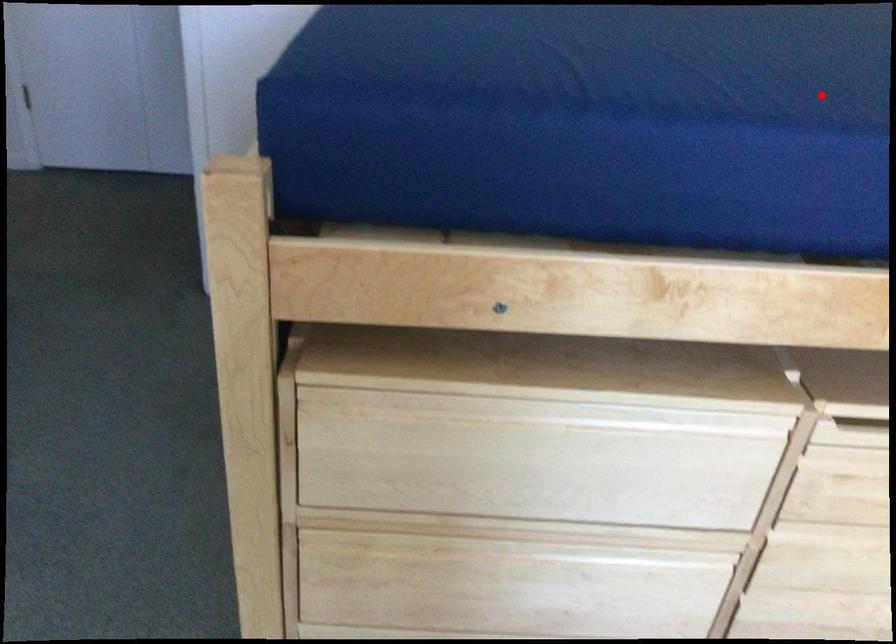
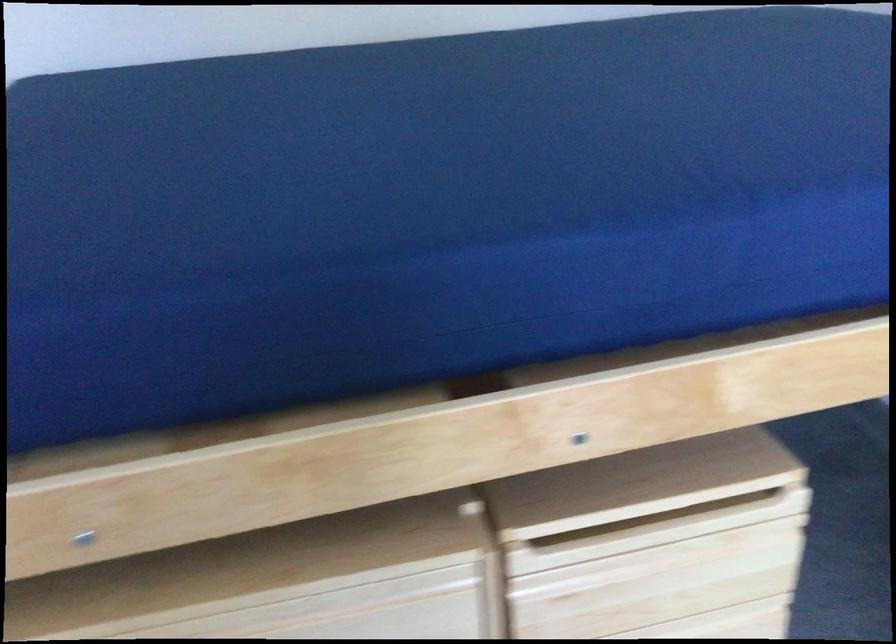
Locate, in the second image, the point that corresponds to the highlighted location in the first image.

(431, 210)